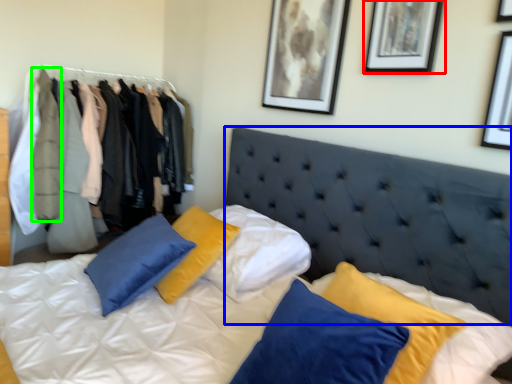
Question: Which is nearer to the picture frame (highlighted by a red box)? headboard (highlighted by a blue box) or clothing (highlighted by a green box).

Choices:
 (A) headboard
 (B) clothing

Answer: (A)